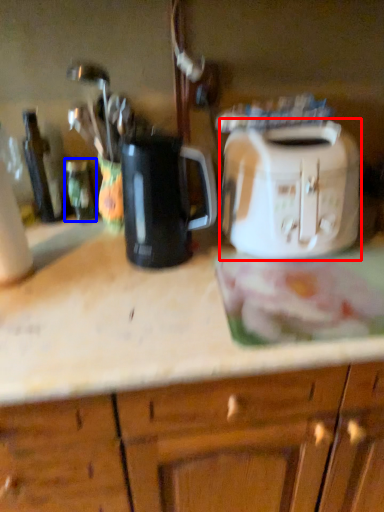
Question: Which point is further to the camera, toaster (highlighted by a red box) or bottle (highlighted by a blue box)?

Choices:
 (A) toaster
 (B) bottle

Answer: (B)